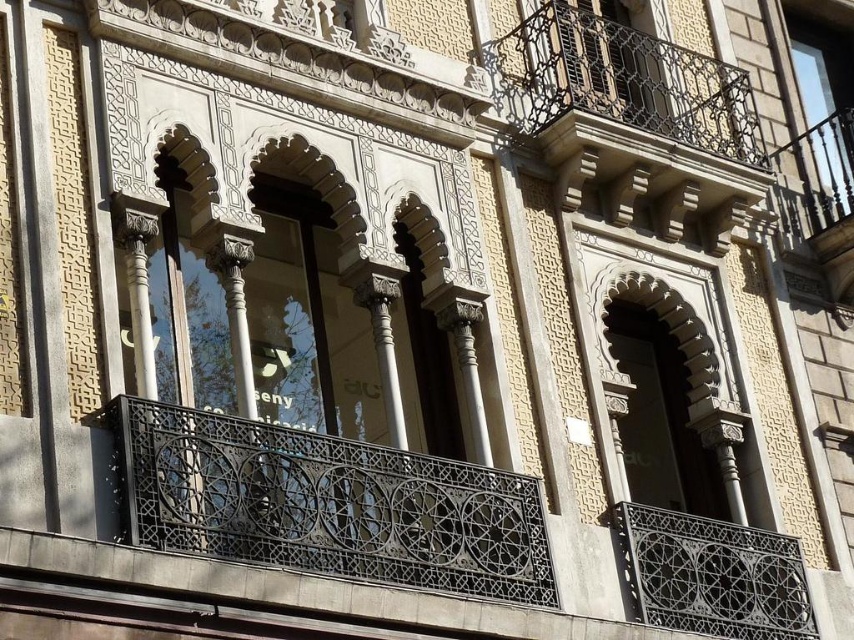
Does dark gray wrought iron at center come in front of black wrought iron balustrade at lower right?

Yes.

Is dark gray wrought iron at center to the right of black wrought iron balustrade at lower right from the viewer's perspective?

No, dark gray wrought iron at center is not to the right of black wrought iron balustrade at lower right.

Is point (521, 490) positioned behind point (642, 596)?

No, it is not.

Image resolution: width=854 pixels, height=640 pixels. What are the coordinates of `dark gray wrought iron at center` in the screenshot? It's located at (328, 504).